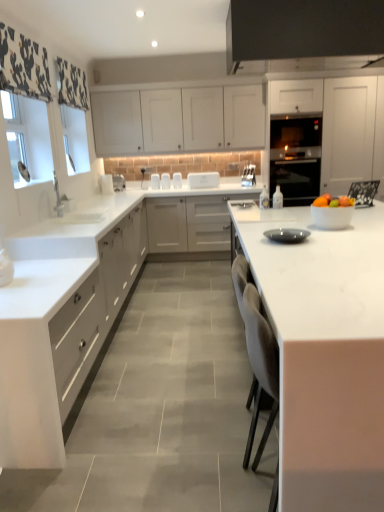
Question: Do you think white glossy bowl at right is within black glass oven at center, or outside of it?

Choices:
 (A) inside
 (B) outside

Answer: (B)

Question: Based on their sizes in the image, would you say white glossy bowl at right is bigger or smaller than black glass oven at center?

Choices:
 (A) big
 (B) small

Answer: (B)

Question: Which object is positioned farthest from the white marble countertop at center, acting as the first countertop starting from the left?

Choices:
 (A) white matte cabinet at upper center, the second cabinetry when ordered from left to right
 (B) white glossy toaster at center, the 2th appliance when ordered from right to left
 (C) white marble countertop at center, the first countertop when ordered from right to left
 (D) white matte cabinet at center, marked as the second cabinetry in a right-to-left arrangement
 (E) white matte cabinet at right, the fourth cabinetry positioned from the left

Answer: (E)

Question: Estimate the real-world distances between objects in this image. Which object is closer to the white marble countertop at center, acting as the 2th countertop starting from the right?

Choices:
 (A) white matte cabinet at center, marked as the 3th cabinetry in a left-to-right arrangement
 (B) matte gray plate at center, the first appliance from the right
 (C) white glass window screen at left
 (D) white glossy bowl at right
 (E) white matte cabinet at right, placed as the first cabinetry when sorted from right to left

Answer: (C)